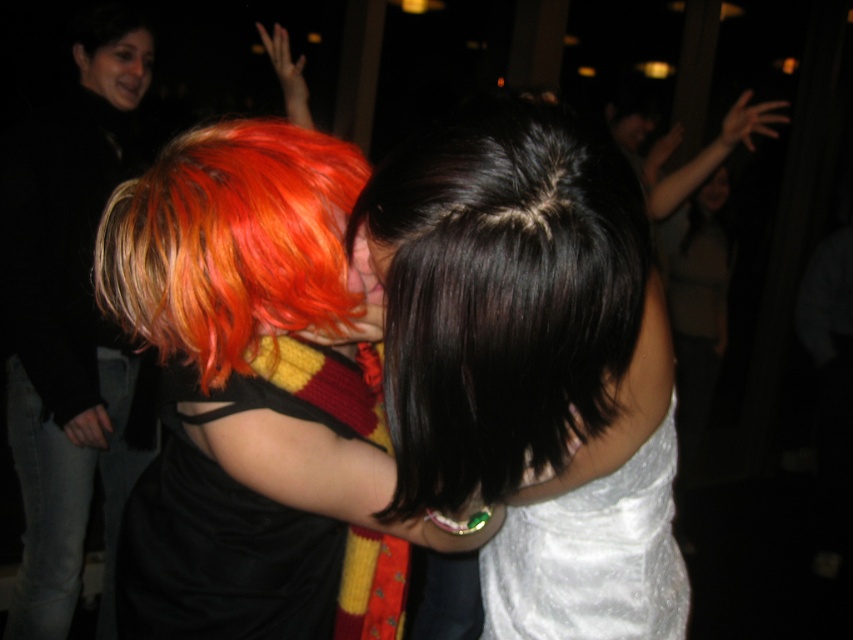
Question: Which object is the farthest from the shiny orange wig at center?

Choices:
 (A) black satin dress at center
 (B) white satin dress at center

Answer: (B)

Question: Which of these objects is positioned closest to the black satin dress at center?

Choices:
 (A) shiny orange wig at center
 (B) shiny black hair at center
 (C) white satin dress at center

Answer: (A)

Question: Is the position of shiny orange wig at center less distant than that of white satin dress at center?

Choices:
 (A) no
 (B) yes

Answer: (A)

Question: Can you confirm if black satin dress at center is positioned above shiny orange wig at center?

Choices:
 (A) no
 (B) yes

Answer: (A)

Question: Is the position of shiny black hair at center more distant than that of shiny orange wig at center?

Choices:
 (A) no
 (B) yes

Answer: (A)

Question: Which of the following is the closest to the observer?

Choices:
 (A) shiny black hair at center
 (B) black satin dress at center

Answer: (A)